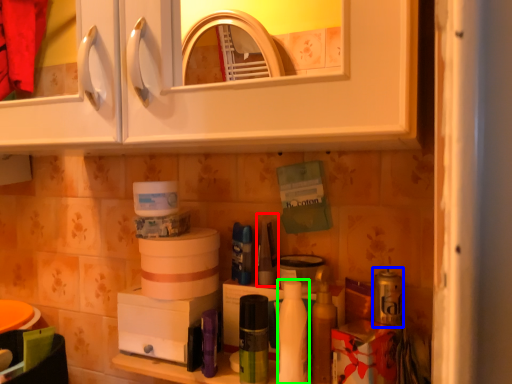
Question: Estimate the real-world distances between objects in this image. Which object is farther from toiletry (highlighted by a red box), toiletry (highlighted by a blue box) or cleaning product (highlighted by a green box)?

Choices:
 (A) toiletry
 (B) cleaning product

Answer: (A)